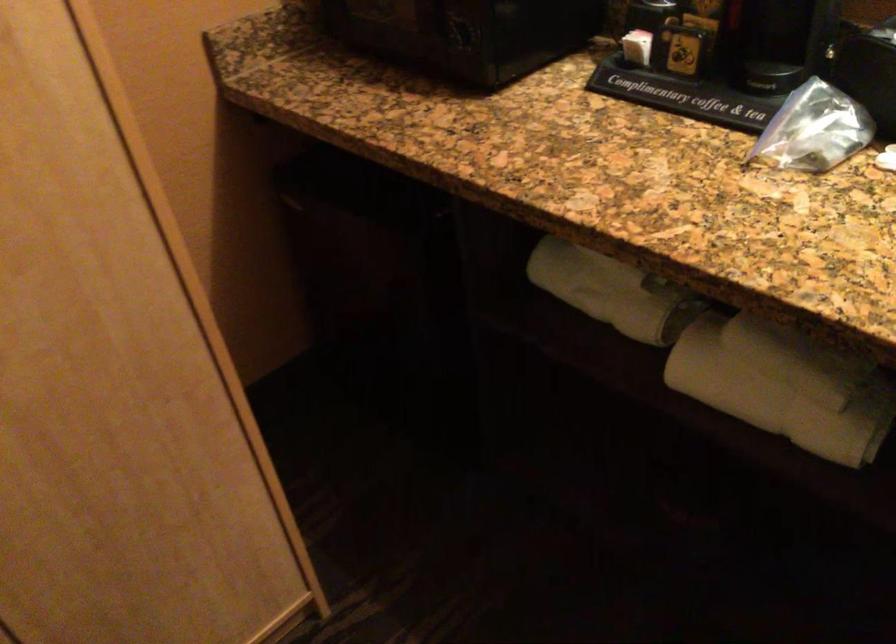
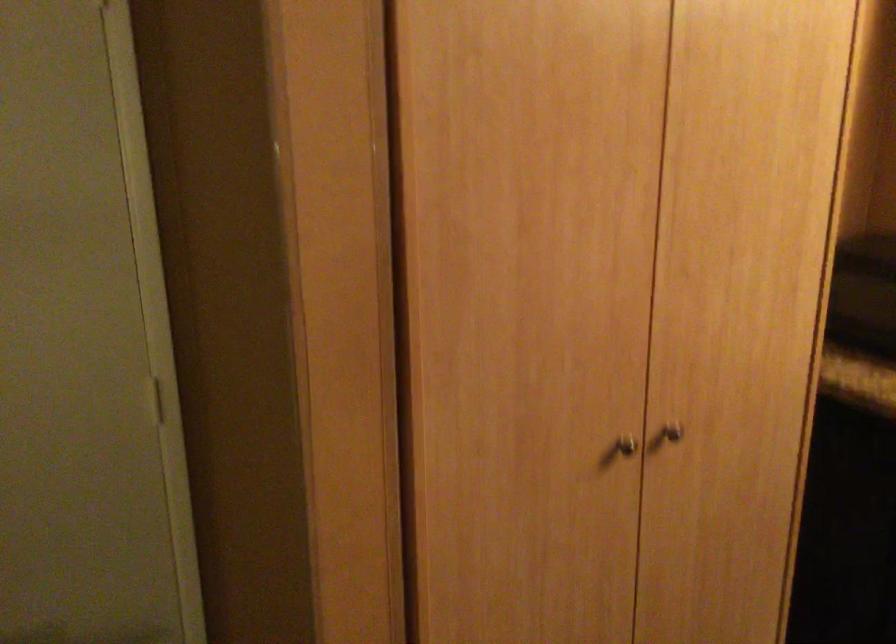
Which direction would the cameraman need to move to produce the second image?

The movement direction of the cameraman is left, backward.